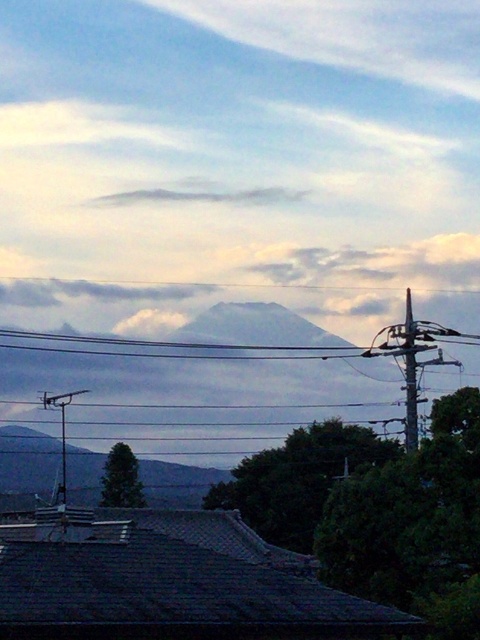
Question: Is gray rocky mountain at center to the right of white fluffy cloud at upper center from the viewer's perspective?

Choices:
 (A) yes
 (B) no

Answer: (A)

Question: Estimate the real-world distances between objects in this image. Which object is farther from the gray rocky mountain at center?

Choices:
 (A) white fluffy cloud at upper center
 (B) white cotton cloud at upper center

Answer: (B)

Question: In this image, where is gray rocky mountain at center located relative to white cotton cloud at upper center?

Choices:
 (A) above
 (B) below

Answer: (B)

Question: Which point is closer to the camera taking this photo?

Choices:
 (A) (276, 193)
 (B) (163, 314)

Answer: (B)

Question: Which is nearer to the gray rocky mountain at center?

Choices:
 (A) white cotton cloud at upper center
 (B) white fluffy cloud at upper center

Answer: (B)

Question: Is gray rocky mountain at center below white fluffy cloud at upper center?

Choices:
 (A) yes
 (B) no

Answer: (A)